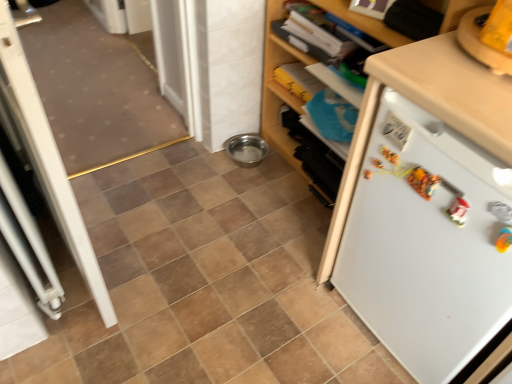
Question: From a real-world perspective, is white matte cabinet at upper right physically below white plastic screen door at left?

Choices:
 (A) yes
 (B) no

Answer: (A)

Question: Does white matte cabinet at upper right contain white plastic screen door at left?

Choices:
 (A) no
 (B) yes

Answer: (A)

Question: From the image's perspective, is white matte cabinet at upper right beneath white plastic screen door at left?

Choices:
 (A) yes
 (B) no

Answer: (B)

Question: Is white matte cabinet at upper right thinner than white plastic screen door at left?

Choices:
 (A) no
 (B) yes

Answer: (A)

Question: Is white matte cabinet at upper right taller than white plastic screen door at left?

Choices:
 (A) yes
 (B) no

Answer: (B)

Question: From a real-world perspective, relative to white plastic screen door at left, is white matte cabinet at upper right vertically above or below?

Choices:
 (A) above
 (B) below

Answer: (B)

Question: In the image, is white matte cabinet at upper right on the left side or the right side of white plastic screen door at left?

Choices:
 (A) right
 (B) left

Answer: (A)

Question: From the image's perspective, is white matte cabinet at upper right above or below white plastic screen door at left?

Choices:
 (A) below
 (B) above

Answer: (B)

Question: Which is correct: white matte cabinet at upper right is inside white plastic screen door at left, or outside of it?

Choices:
 (A) inside
 (B) outside

Answer: (B)

Question: In terms of height, does white matte refrigerator at right look taller or shorter compared to white matte cabinet at upper right?

Choices:
 (A) tall
 (B) short

Answer: (B)

Question: From a real-world perspective, relative to white matte cabinet at upper right, is white matte refrigerator at right vertically above or below?

Choices:
 (A) above
 (B) below

Answer: (B)

Question: Considering the relative positions of white matte refrigerator at right and white matte cabinet at upper right in the image provided, is white matte refrigerator at right to the left or to the right of white matte cabinet at upper right?

Choices:
 (A) right
 (B) left

Answer: (A)

Question: Is white matte refrigerator at right in front of or behind white matte cabinet at upper right in the image?

Choices:
 (A) front
 (B) behind

Answer: (A)

Question: Based on their sizes in the image, would you say white matte cabinet at upper right is bigger or smaller than white matte refrigerator at right?

Choices:
 (A) big
 (B) small

Answer: (B)

Question: Relative to white matte refrigerator at right, is white matte cabinet at upper right in front or behind?

Choices:
 (A) front
 (B) behind

Answer: (B)